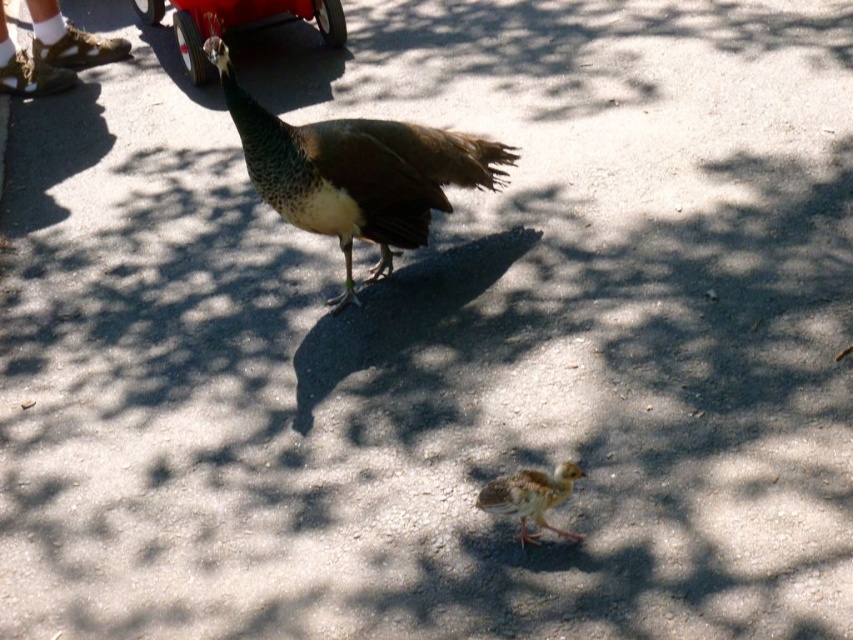
Question: Which point is closer to the camera taking this photo?

Choices:
 (A) (242, 4)
 (B) (529, 472)

Answer: (B)

Question: Considering the relative positions of shiny brown peacock at center and metallic red car at upper left in the image provided, where is shiny brown peacock at center located with respect to metallic red car at upper left?

Choices:
 (A) above
 (B) below

Answer: (B)

Question: Estimate the real-world distances between objects in this image. Which object is closer to the metallic red car at upper left?

Choices:
 (A) shiny brown peacock at center
 (B) brown speckled chick at lower center

Answer: (A)

Question: Which point appears closest to the camera in this image?

Choices:
 (A) (267, 1)
 (B) (328, 138)
 (C) (534, 538)

Answer: (C)

Question: Does metallic red car at upper left lie behind brown speckled chick at lower center?

Choices:
 (A) yes
 (B) no

Answer: (A)

Question: Is metallic red car at upper left to the left of brown speckled chick at lower center from the viewer's perspective?

Choices:
 (A) no
 (B) yes

Answer: (B)